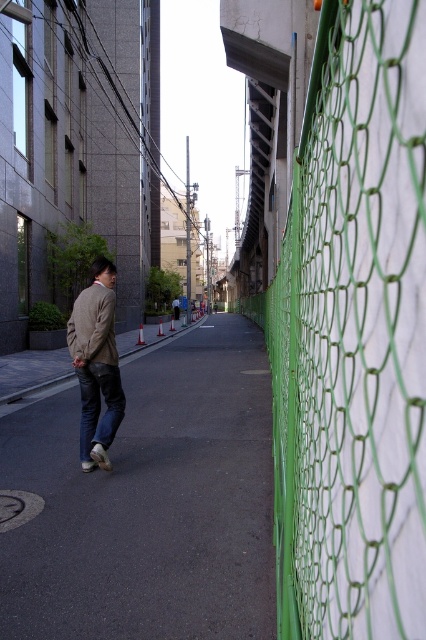
Between point (89, 426) and point (85, 387), which one is positioned in front?

Positioned in front is point (85, 387).

Which is more to the left, light brown textured blazer at center or jeans at center?

From the viewer's perspective, jeans at center appears more on the left side.

Is point (112, 308) farther from viewer compared to point (89, 408)?

No, it is not.

Locate an element on the screen. light brown textured blazer at center is located at coordinates (97, 364).

Is point (86, 371) farther from viewer compared to point (106, 352)?

Yes.

The width and height of the screenshot is (426, 640). Describe the element at coordinates (98, 406) in the screenshot. I see `jeans at center` at that location.

The height and width of the screenshot is (640, 426). In order to click on jeans at center in this screenshot , I will do `click(98, 406)`.

Between light brown textured blazer at center and beige woolen jacket at left, which one appears on the right side from the viewer's perspective?

From the viewer's perspective, beige woolen jacket at left appears more on the right side.

At what (x,y) coordinates should I click in order to perform the action: click on light brown textured blazer at center. Please return your answer as a coordinate pair (x, y). The image size is (426, 640). Looking at the image, I should click on (97, 364).

Identify the location of light brown textured blazer at center. The image size is (426, 640). (97, 364).